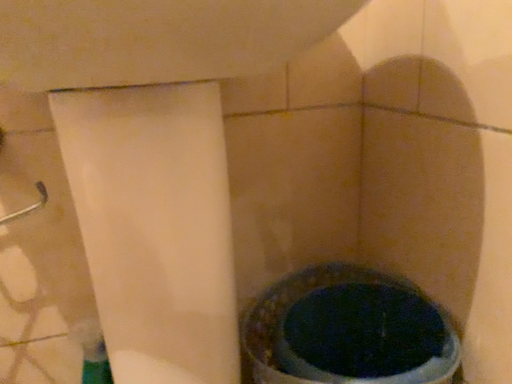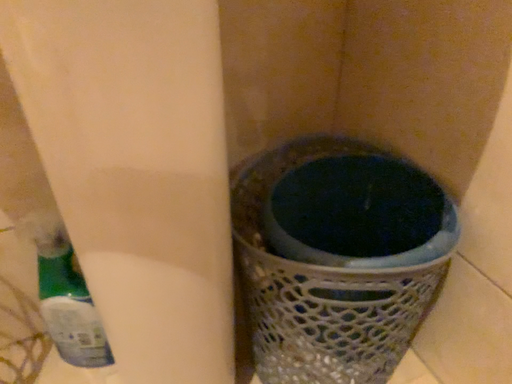
Question: Which way did the camera rotate in the video?

Choices:
 (A) rotated left
 (B) rotated right

Answer: (B)